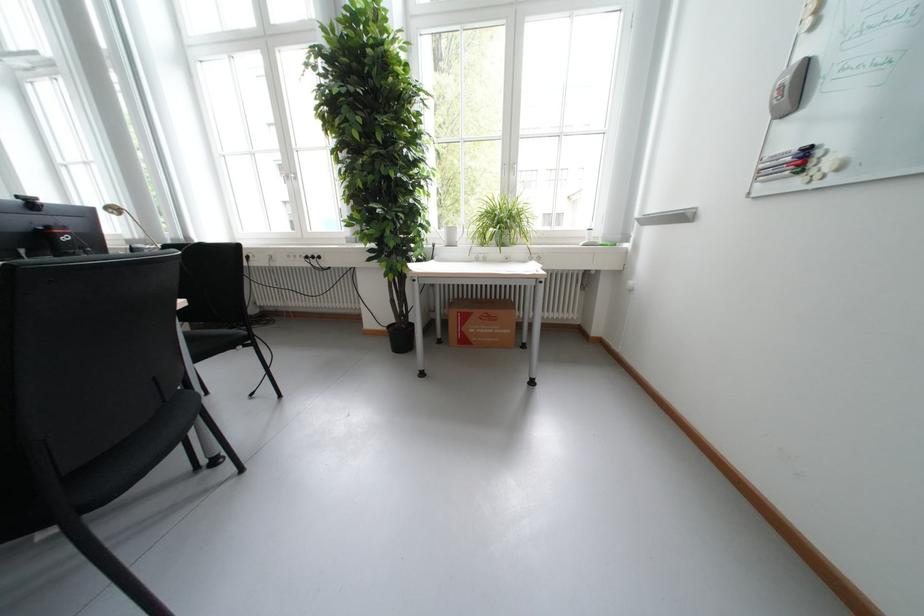
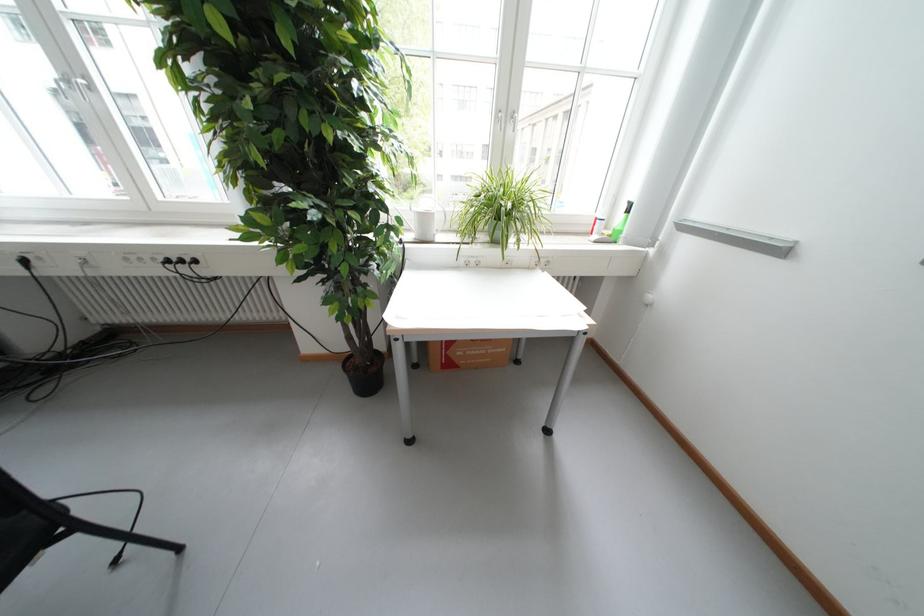
Locate, in the second image, the point that corresponds to (317,257) in the first image.

(177, 262)